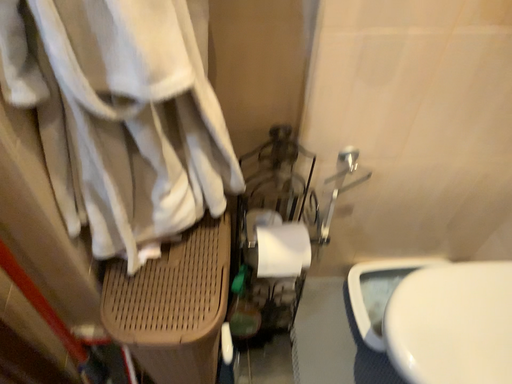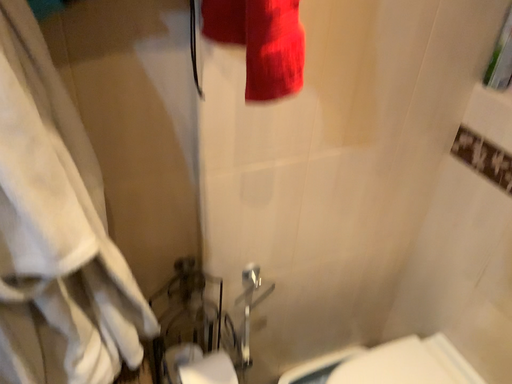
Question: Which way did the camera rotate in the video?

Choices:
 (A) rotated right
 (B) rotated left

Answer: (A)